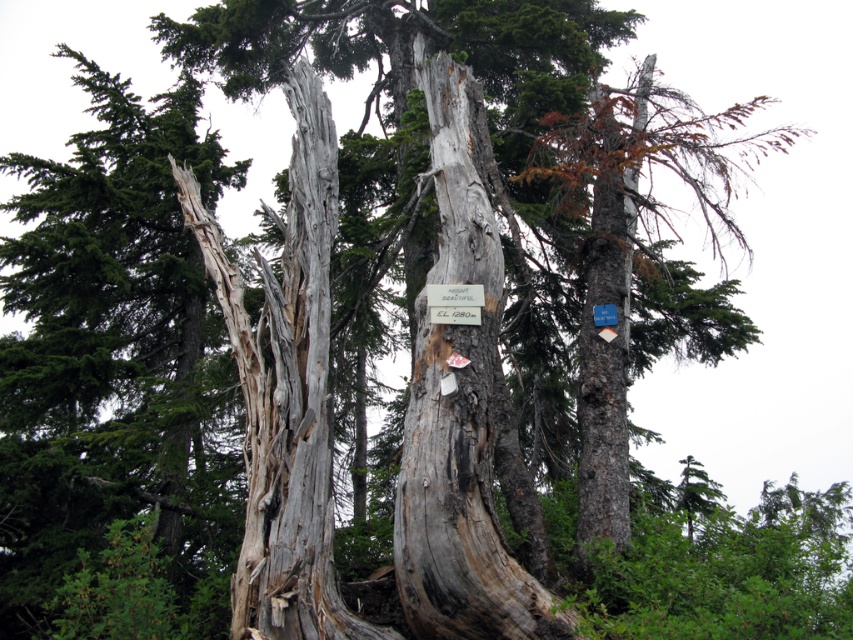
Is gray rough bark tree trunk at center below white paper sign at center?

Incorrect, gray rough bark tree trunk at center is not positioned below white paper sign at center.

Does gray rough bark tree trunk at center appear on the right side of white paper sign at center?

Incorrect, gray rough bark tree trunk at center is not on the right side of white paper sign at center.

Is point (451, 156) positioned in front of point (610, 314)?

Yes, point (451, 156) is closer to viewer.

You are a GUI agent. You are given a task and a screenshot of the screen. Output one action in this format:
    pyautogui.click(x=<x>, y=<y>)
    Task: Click on the gray rough bark tree trunk at center
    The width and height of the screenshot is (853, 640).
    Given the screenshot: What is the action you would take?
    [459, 401]

In the scene shown: Can you confirm if gray rough bark tree trunk at center is bigger than green wood sign at center?

Indeed, gray rough bark tree trunk at center has a larger size compared to green wood sign at center.

Does gray rough bark tree trunk at center appear on the left side of green wood sign at center?

In fact, gray rough bark tree trunk at center is to the right of green wood sign at center.

Image resolution: width=853 pixels, height=640 pixels. I want to click on gray rough bark tree trunk at center, so 459,401.

Who is taller, green wood sign at center or white paper sign at center?

green wood sign at center

Between green wood sign at center and white paper sign at center, which one is positioned lower?

white paper sign at center

Locate an element on the screen. green wood sign at center is located at coordinates (454, 304).